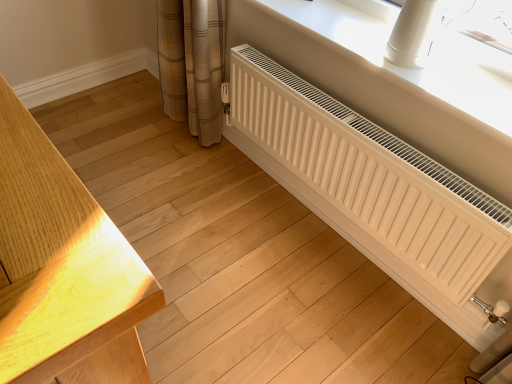
Question: Does white matte radiator at lower right have a larger size compared to white plastic radiator at lower right?

Choices:
 (A) no
 (B) yes

Answer: (B)

Question: From the image's perspective, is white matte radiator at lower right above white plastic radiator at lower right?

Choices:
 (A) yes
 (B) no

Answer: (B)

Question: Are white matte radiator at lower right and white plastic radiator at lower right far apart?

Choices:
 (A) no
 (B) yes

Answer: (A)

Question: From a real-world perspective, is white matte radiator at lower right on top of white plastic radiator at lower right?

Choices:
 (A) yes
 (B) no

Answer: (B)

Question: Can you confirm if white matte radiator at lower right is positioned to the right of white plastic radiator at lower right?

Choices:
 (A) no
 (B) yes

Answer: (A)

Question: From the image's perspective, is white matte radiator at lower right located beneath white plastic radiator at lower right?

Choices:
 (A) no
 (B) yes

Answer: (B)

Question: Can you confirm if white plastic radiator at lower right is taller than white matte radiator at lower right?

Choices:
 (A) no
 (B) yes

Answer: (A)

Question: Is white plastic radiator at lower right facing towards white matte radiator at lower right?

Choices:
 (A) yes
 (B) no

Answer: (B)

Question: Does white plastic radiator at lower right touch white matte radiator at lower right?

Choices:
 (A) yes
 (B) no

Answer: (B)

Question: Is the depth of white plastic radiator at lower right greater than that of white matte radiator at lower right?

Choices:
 (A) yes
 (B) no

Answer: (A)

Question: Would you say white plastic radiator at lower right is a long distance from white matte radiator at lower right?

Choices:
 (A) no
 (B) yes

Answer: (A)

Question: Is white plastic radiator at lower right bigger than white matte radiator at lower right?

Choices:
 (A) no
 (B) yes

Answer: (A)

Question: Is white plastic radiator at lower right in front of or behind white matte radiator at lower right in the image?

Choices:
 (A) front
 (B) behind

Answer: (B)